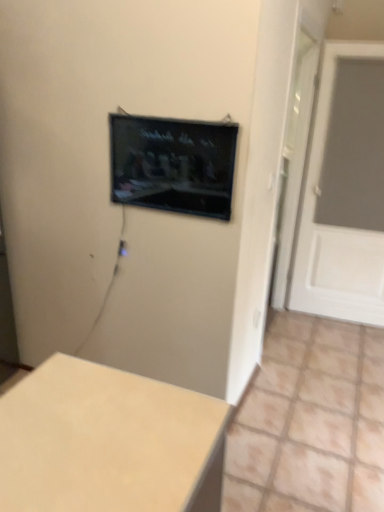
Measure the distance between point (x=136, y=117) and camera.

They are 1.86 meters apart.

You are a GUI agent. You are given a task and a screenshot of the screen. Output one action in this format:
    pyautogui.click(x=<x>, y=<y>)
    Task: Click on the black glossy tv at upper center
    Image resolution: width=384 pixels, height=512 pixels.
    Given the screenshot: What is the action you would take?
    pyautogui.click(x=173, y=164)

Image resolution: width=384 pixels, height=512 pixels. I want to click on black glossy tv at upper center, so click(x=173, y=164).

Locate an element on the screen. door that appears above the beige matte table at lower left (from the image's perspective) is located at coordinates (344, 191).

Considering their positions, is white matte door at right located in front of or behind beige matte table at lower left?

white matte door at right is behind beige matte table at lower left.

Is white matte door at right at the right side of beige matte table at lower left?

Yes.

In terms of size, does white matte door at right appear bigger or smaller than black glossy tv at upper center?

In the image, white matte door at right appears to be larger than black glossy tv at upper center.

From the image's perspective, is white matte door at right located above or below black glossy tv at upper center?

white matte door at right is above black glossy tv at upper center.

This screenshot has height=512, width=384. I want to click on computer screen above the white matte door at right (from a real-world perspective), so click(x=173, y=164).

Considering the positions of objects black glossy tv at upper center and white matte door at right in the image provided, who is in front, black glossy tv at upper center or white matte door at right?

Positioned in front is black glossy tv at upper center.

From a real-world perspective, relative to white matte door at right, is black glossy tv at upper center vertically above or below?

black glossy tv at upper center is above white matte door at right.

Is black glossy tv at upper center next to white matte door at right and touching it?

black glossy tv at upper center and white matte door at right are not in contact.

Which of these two, black glossy tv at upper center or white matte door at right, is wider?

white matte door at right is wider.

From the image's perspective, does beige matte table at lower left appear higher than black glossy tv at upper center?

Actually, beige matte table at lower left appears below black glossy tv at upper center in the image.

Would you say beige matte table at lower left contains black glossy tv at upper center?

No.

Image resolution: width=384 pixels, height=512 pixels. Identify the location of computer screen lying behind the beige matte table at lower left. (x=173, y=164).

Is beige matte table at lower left bigger than white matte door at right?

Yes, beige matte table at lower left is bigger than white matte door at right.

In terms of height, does beige matte table at lower left look taller or shorter compared to white matte door at right?

In the image, beige matte table at lower left appears to be shorter than white matte door at right.

From the image's perspective, is beige matte table at lower left under white matte door at right?

Yes, from the image's perspective, beige matte table at lower left is beneath white matte door at right.

Considering the relative positions of beige matte table at lower left and white matte door at right in the image provided, is beige matte table at lower left behind white matte door at right?

No, the depth of beige matte table at lower left is less than that of white matte door at right.

From the image's perspective, is black glossy tv at upper center on beige matte table at lower left?

Yes, from the image's perspective, black glossy tv at upper center is on top of beige matte table at lower left.

Is black glossy tv at upper center directly adjacent to beige matte table at lower left?

No, black glossy tv at upper center is not next to beige matte table at lower left.

Can you confirm if black glossy tv at upper center is wider than beige matte table at lower left?

In fact, black glossy tv at upper center might be narrower than beige matte table at lower left.

From a real-world perspective, is black glossy tv at upper center below beige matte table at lower left?

No, from a real-world perspective, black glossy tv at upper center is not under beige matte table at lower left.

You are a GUI agent. You are given a task and a screenshot of the screen. Output one action in this format:
    pyautogui.click(x=<x>, y=<y>)
    Task: Click on the table in front of the white matte door at right
    The width and height of the screenshot is (384, 512).
    Given the screenshot: What is the action you would take?
    pyautogui.click(x=108, y=442)

Where is `computer screen located above the white matte door at right (from a real-world perspective)`? This screenshot has width=384, height=512. computer screen located above the white matte door at right (from a real-world perspective) is located at coordinates (173, 164).

Considering their positions, is black glossy tv at upper center positioned further to white matte door at right than beige matte table at lower left?

beige matte table at lower left is further to white matte door at right.

Considering their positions, is beige matte table at lower left positioned further to white matte door at right than black glossy tv at upper center?

The object further to white matte door at right is beige matte table at lower left.

Which object lies nearer to the anchor point beige matte table at lower left, white matte door at right or black glossy tv at upper center?

black glossy tv at upper center is positioned closer to the anchor beige matte table at lower left.

Which object lies nearer to the anchor point beige matte table at lower left, black glossy tv at upper center or white matte door at right?

black glossy tv at upper center is closer to beige matte table at lower left.

Which object lies nearer to the anchor point black glossy tv at upper center, beige matte table at lower left or white matte door at right?

Based on the image, beige matte table at lower left appears to be nearer to black glossy tv at upper center.

Which object lies further to the anchor point black glossy tv at upper center, white matte door at right or beige matte table at lower left?

white matte door at right.

Find the location of a particular element. The image size is (384, 512). computer screen between beige matte table at lower left and white matte door at right along the z-axis is located at coordinates (173, 164).